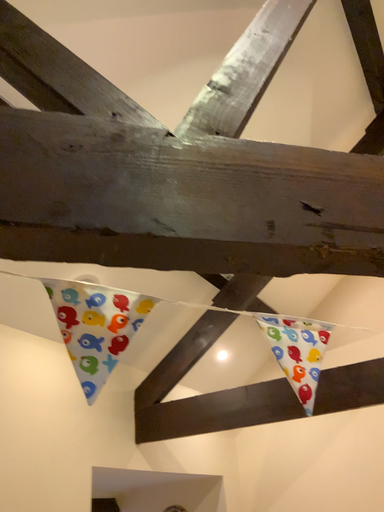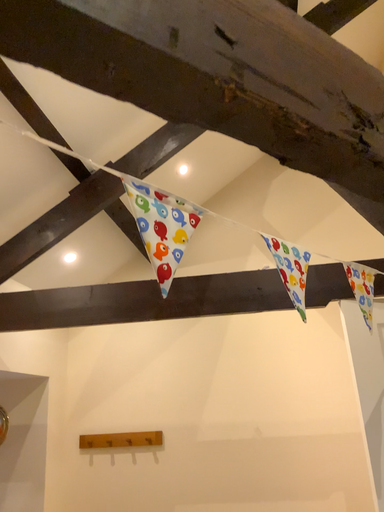
Question: How did the camera likely rotate when shooting the video?

Choices:
 (A) rotated right
 (B) rotated left

Answer: (A)